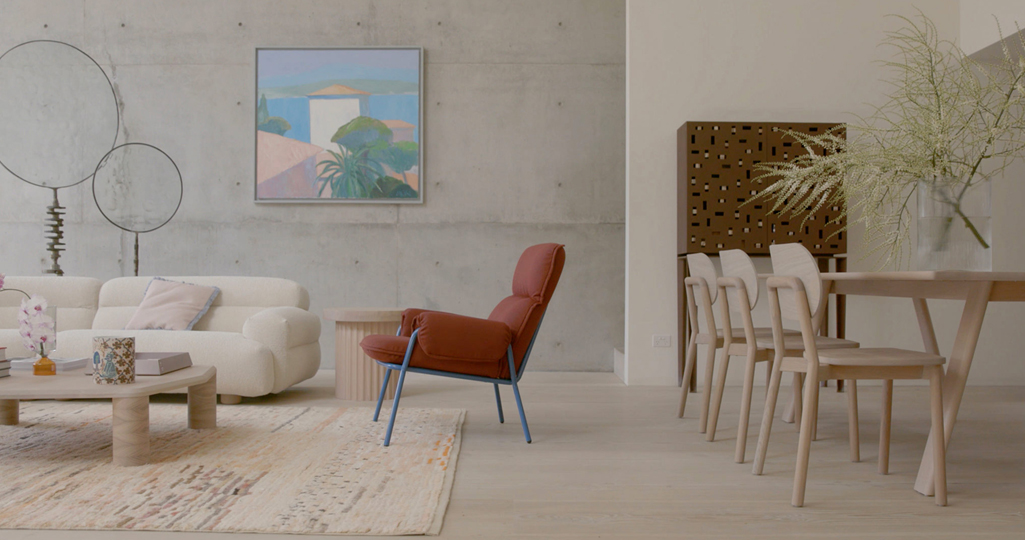
Identify the location of rug in front of couch. (85, 434).